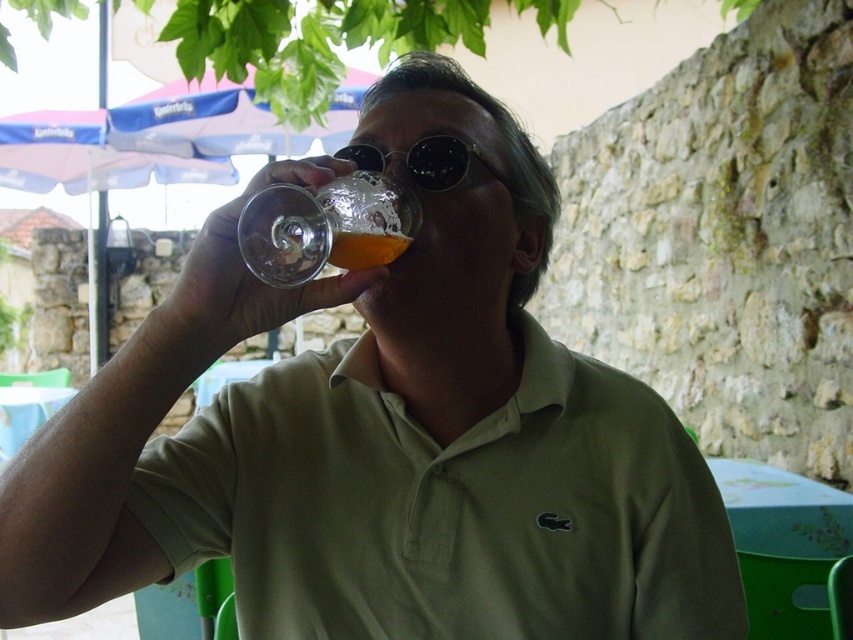
You are a photographer trying to capture the man in the image. You want to ensure both the green cotton polo shirt at center and the translucent glass at upper center are clearly visible in your photo. Which object should you focus on first to ensure depth of field captures both?

The green cotton polo shirt at center is taller than the translucent glass at upper center. To ensure both are in focus, focus on the farther object first, which would be the translucent glass at upper center since it is closer to the camera and the shirt is behind it. However, since the shirt is taller, adjusting focus might require a mid point. Alternatively, using a smaller aperture could help maximize depth of field for both.

What is the 2D coordinate of the green cotton polo shirt at center in the image?

The 2D coordinate of the green cotton polo shirt at center is at point (447,508).

You are a photographer trying to capture the man in the green cotton polo shirt at center. The camera is positioned at point 0.0, 0.0. To ensure the shirt is in focus, where should you aim the camera? Please provide coordinates based on the image grid system.

The green cotton polo shirt at center is located at point (447,508), so you should aim the camera at those coordinates to focus on the shirt.